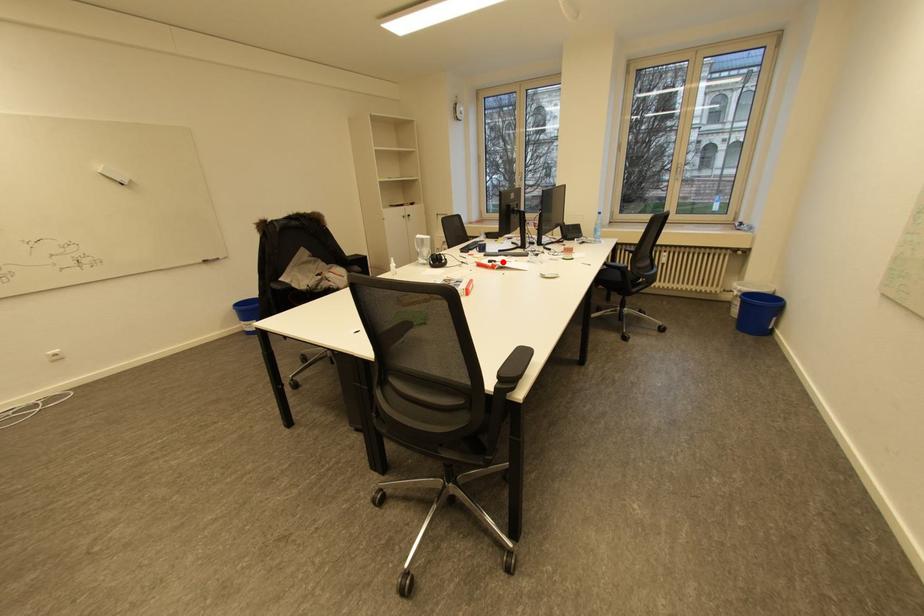
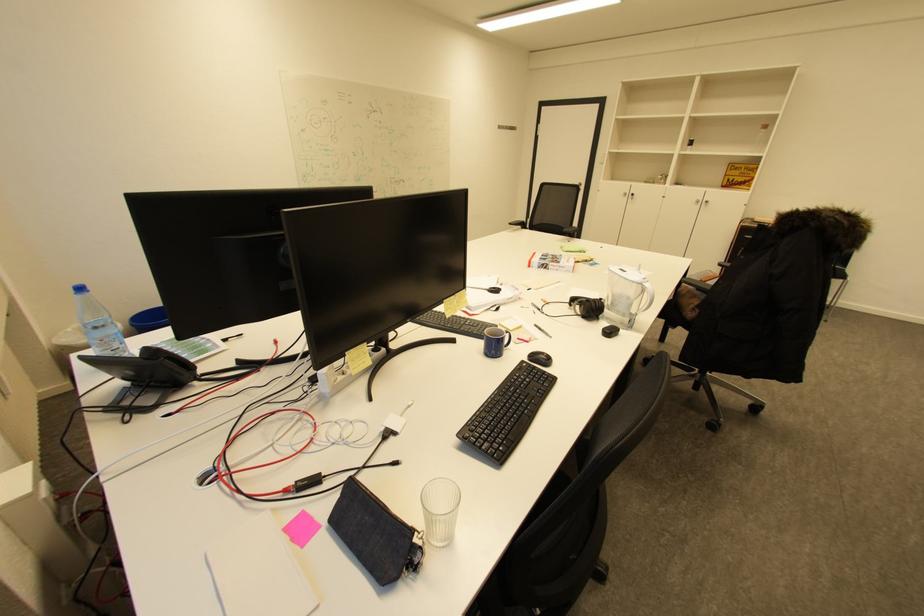
The point at the highlighted location is marked in the first image. Where is the corresponding point in the second image?

(492, 292)